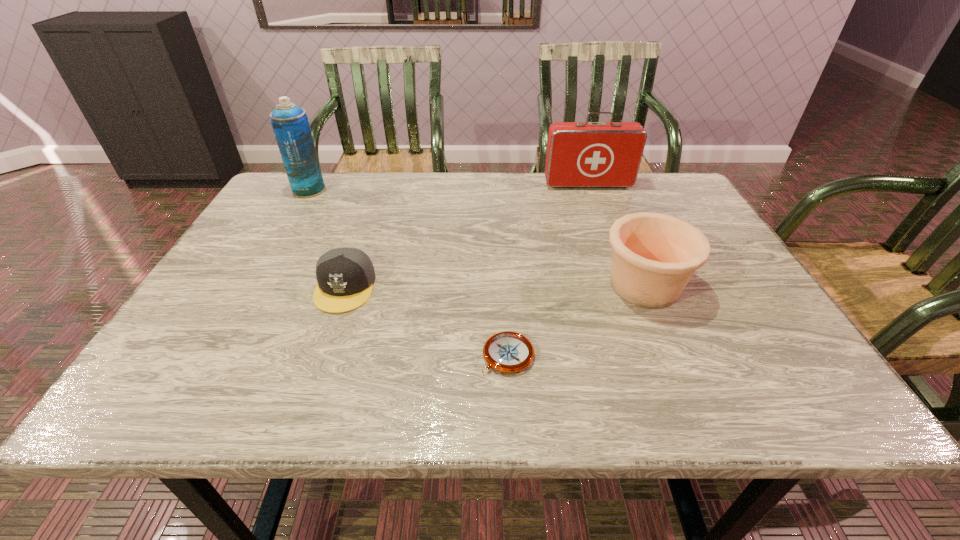
Identify the location of free space that is in between the second tallest object and the tallest object. (448, 187).

This screenshot has height=540, width=960. I want to click on free space that is in between the third shortest object and the cap, so click(494, 286).

Locate an element on the screen. vacant space in between the third tallest object and the leftmost object is located at coordinates (477, 238).

Locate an element on the screen. vacant space that is in between the pottery and the leftmost object is located at coordinates (477, 238).

What are the coordinates of `object that stands as the third closest to the tallest object` in the screenshot? It's located at (509, 352).

Identify which object is located as the fourth nearest to the first-aid kit. Please provide its 2D coordinates. Your answer should be formatted as a tuple, i.e. [(x, y)], where the tuple contains the x and y coordinates of a point satisfying the conditions above.

[(290, 124)]

Identify the location of free space in the image that satisfies the following two spatial constraints: 1. on the back side of the third tallest object; 2. on the left side of the nearest object. This screenshot has height=540, width=960. (504, 285).

Where is `vacant space that satisfies the following two spatial constraints: 1. on the side of the fourth shortest object with the first aid cross symbol; 2. on the left side of the pottery`? vacant space that satisfies the following two spatial constraints: 1. on the side of the fourth shortest object with the first aid cross symbol; 2. on the left side of the pottery is located at coordinates (625, 285).

Identify the location of blank area in the image that satisfies the following two spatial constraints: 1. on the side of the third tallest object with the first aid cross symbol; 2. on the right side of the second tallest object. The width and height of the screenshot is (960, 540). (625, 285).

Find the location of a particular element. This screenshot has height=540, width=960. vacant point that satisfies the following two spatial constraints: 1. on the side of the first-aid kit with the first aid cross symbol; 2. on the right side of the pottery is located at coordinates (625, 285).